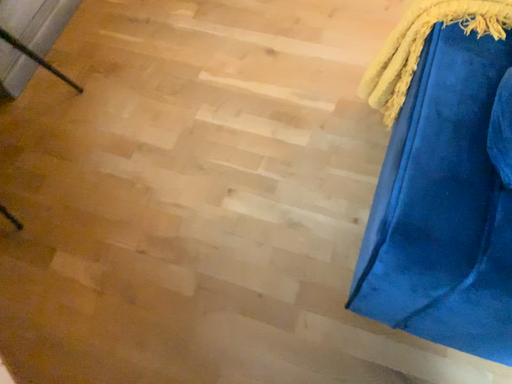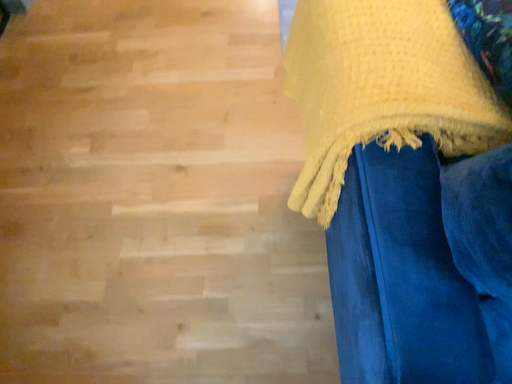
Question: Which way did the camera rotate in the video?

Choices:
 (A) rotated upward
 (B) rotated downward

Answer: (A)